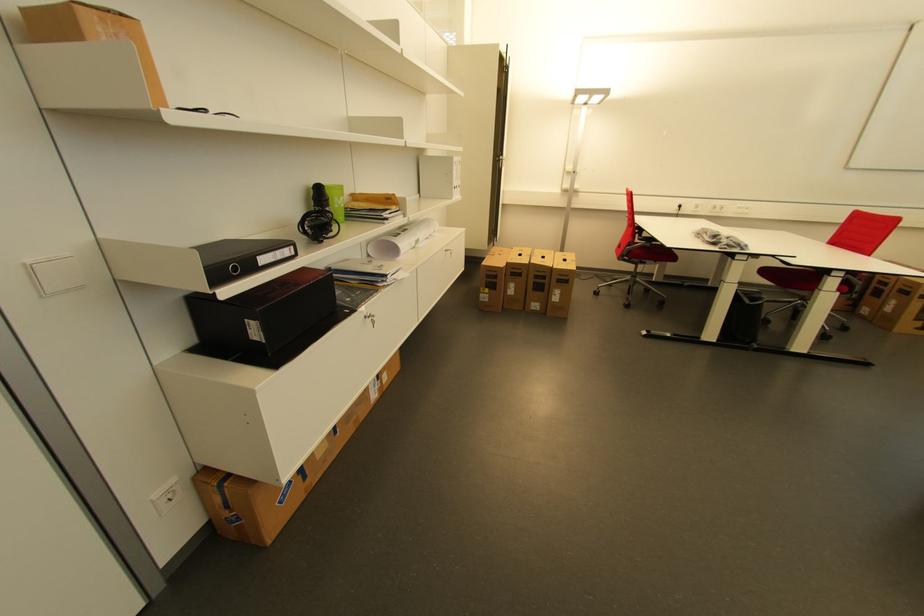
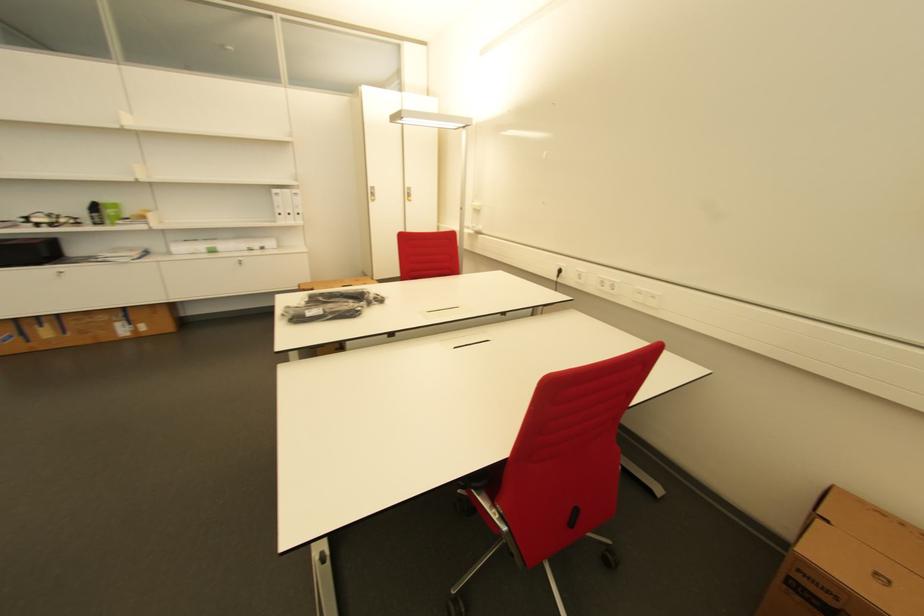
In the second image, find the point that corresponds to point (323, 197) in the first image.

(100, 209)